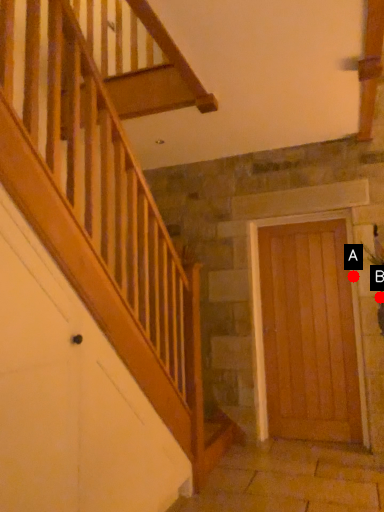
Question: Two points are circled on the image, labeled by A and B beside each circle. Which point is closer to the camera taking this photo?

Choices:
 (A) A is closer
 (B) B is closer

Answer: (B)